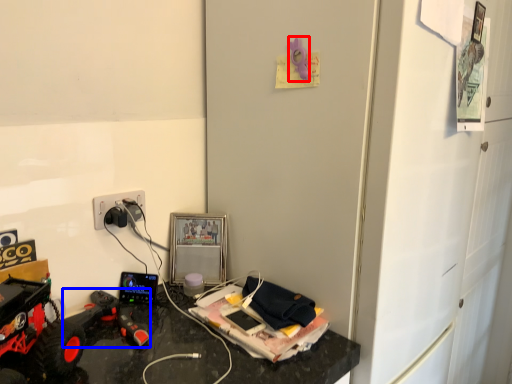
Question: Among these objects, which one is farthest to the camera, toy (highlighted by a red box) or toy (highlighted by a blue box)?

Choices:
 (A) toy
 (B) toy

Answer: (A)